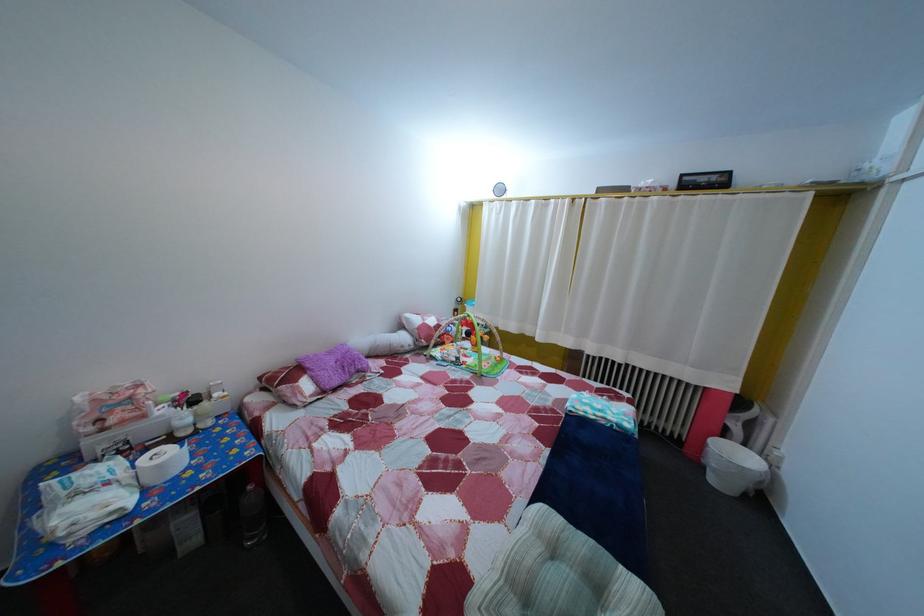
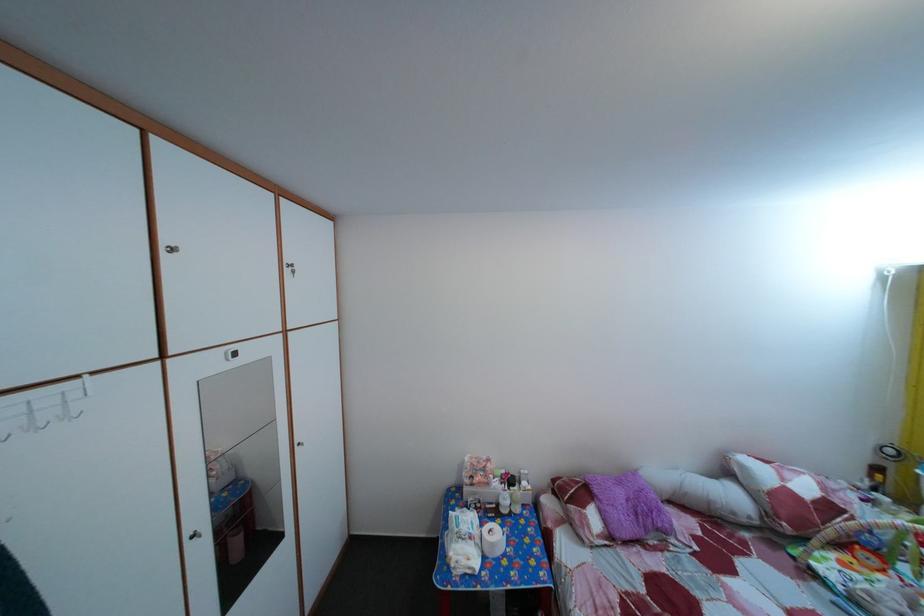
In the second image, find the point that corresponds to point (339, 361) in the first image.

(629, 491)